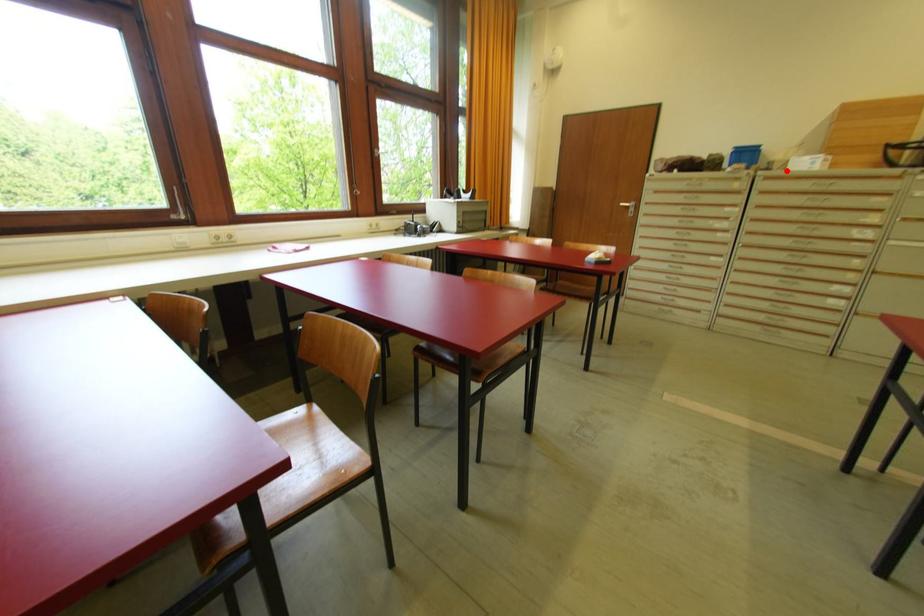
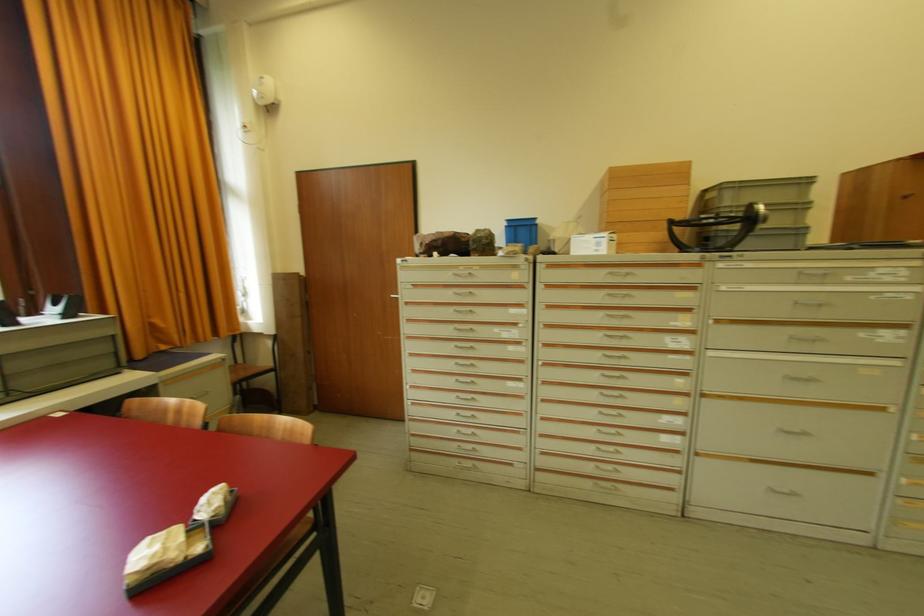
The point at the highlighted location is marked in the first image. Where is the corresponding point in the second image?

(570, 254)